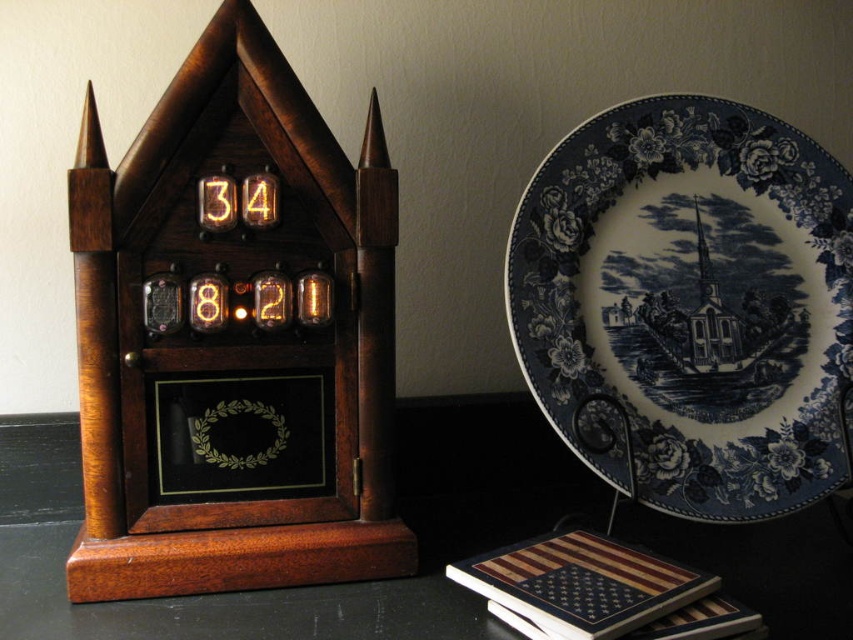
You are standing in front of the wooden table at center and want to place the clock and the decorative plate on it. The table has a surface area of 1.2 square meters. The clock requires 0.5 square meters and the plate requires 0.3 square meters. Can both items fit on the table?

The wooden table at center has a surface area of 1.2 square meters. The clock requires 0.5 square meters and the plate requires 0.3 square meters. Adding both items would require 0.8 square meters, which is less than the table area, so both items can fit on the wooden table at center.

You are organizing a memorial service and need to place a floral arrangement on the wooden table at center. However, there is a wooden american flag at lower right nearby. Based on their positions, which object is closer to the front of the room?

The wooden american flag at lower right is closer to the front of the room because it is positioned to the right of the wooden table at center, which is on its left side.